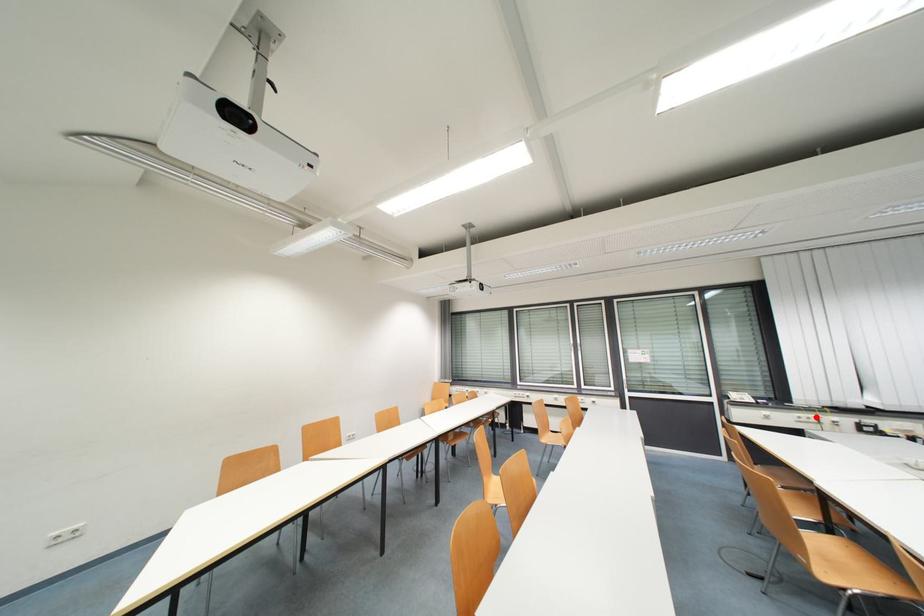
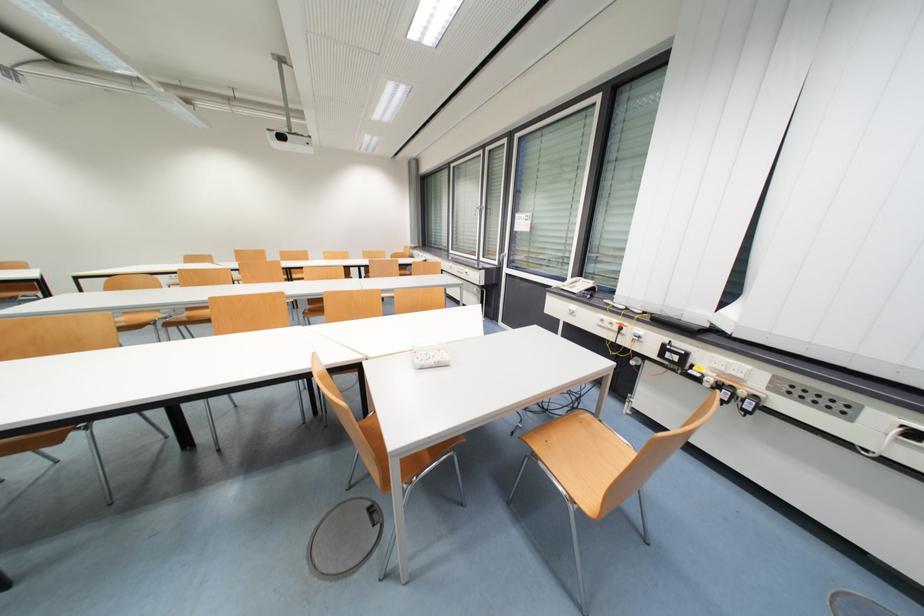
Locate, in the second image, the point that corresponds to the highlighted location in the first image.

(622, 323)